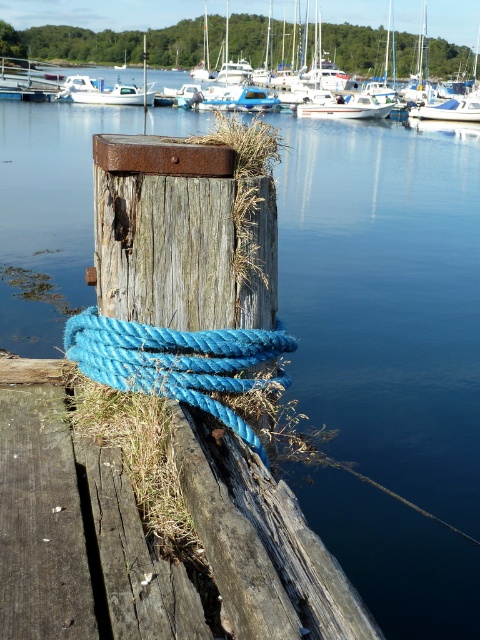
Is weathered wood dock at lower left to the right of white glossy boat at center from the viewer's perspective?

Incorrect, weathered wood dock at lower left is not on the right side of white glossy boat at center.

Is point (46, 630) positioned behind point (326, 106)?

No, it is not.

Locate an element on the screen. The image size is (480, 640). weathered wood dock at lower left is located at coordinates (75, 529).

Does white matte boat at upper left come in front of rustic wood post at center?

That is False.

Is white matte boat at upper left positioned behind rustic wood post at center?

Yes, it is.

Locate an element on the screen. The width and height of the screenshot is (480, 640). white matte boat at upper left is located at coordinates (117, 96).

At what (x,y) coordinates should I click in order to perform the action: click on white matte boat at upper left. Please return your answer as a coordinate pair (x, y). Looking at the image, I should click on (117, 96).

This screenshot has height=640, width=480. What do you see at coordinates (180, 236) in the screenshot?
I see `rusty wood post at center` at bounding box center [180, 236].

Is rusty wood post at center behind white glossy boat at center?

No, it is not.

Between point (215, 262) and point (377, 113), which one is positioned in front?

Positioned in front is point (215, 262).

Locate an element on the screen. rusty wood post at center is located at coordinates (180, 236).